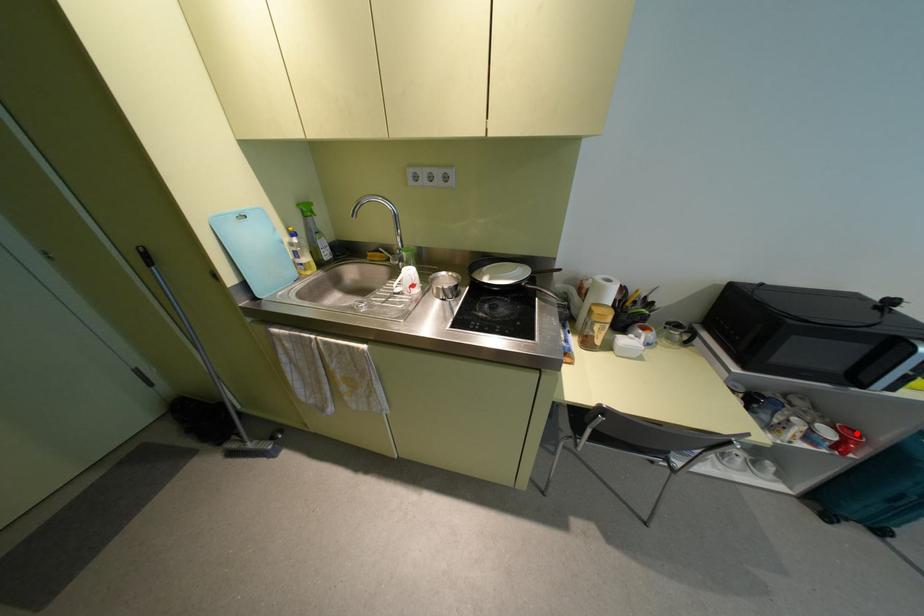
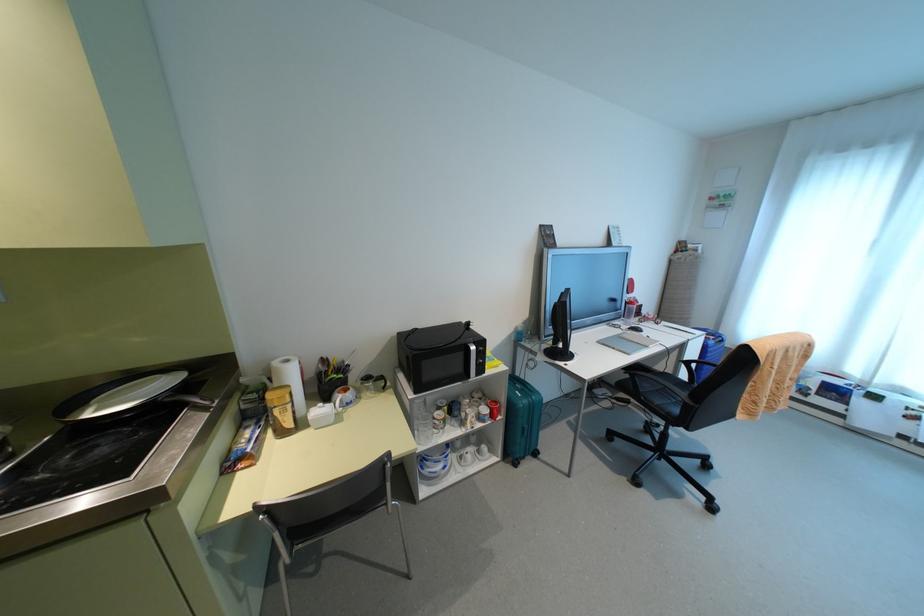
Question: I am providing you with two images of the same scene from different viewpoints. Image1 has a red point marked. In image2, the corresponding 3D location appears at what relative position? Reply with the corresponding letter.

Choices:
 (A) Closer
 (B) Farther

Answer: (B)